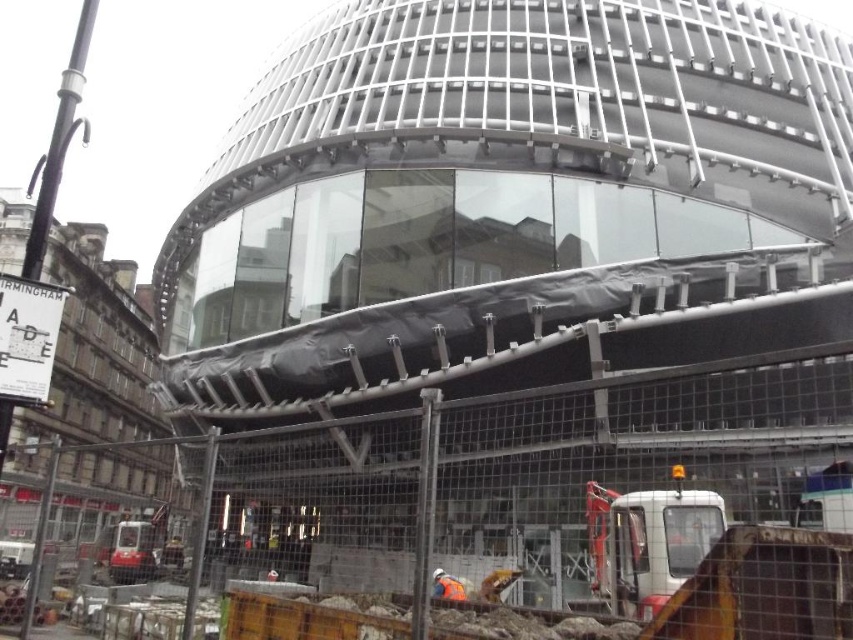
Does white plastic construction vehicle at lower right have a lesser height compared to orange hard hat at center?

No, white plastic construction vehicle at lower right is not shorter than orange hard hat at center.

Can you confirm if white plastic construction vehicle at lower right is wider than orange hard hat at center?

Yes, white plastic construction vehicle at lower right is wider than orange hard hat at center.

Between point (624, 516) and point (434, 593), which one is positioned in front?

Point (624, 516)

Locate an element on the screen. white plastic construction vehicle at lower right is located at coordinates (648, 541).

Does metal mesh fence at center have a larger size compared to orange hard hat at center?

Yes.

Identify the location of metal mesh fence at center. This screenshot has height=640, width=853. (546, 504).

This screenshot has height=640, width=853. What are the coordinates of `metal mesh fence at center` in the screenshot? It's located at (546, 504).

Find the location of a particular element. metal mesh fence at center is located at coordinates (546, 504).

Does metal mesh fence at center have a lesser height compared to metallic construction vehicle at lower left?

Incorrect, metal mesh fence at center's height does not fall short of metallic construction vehicle at lower left's.

Is point (238, 513) positioned before point (120, 532)?

Yes, it is in front of point (120, 532).

The height and width of the screenshot is (640, 853). I want to click on metal mesh fence at center, so click(x=546, y=504).

Locate an element on the screen. The image size is (853, 640). metal mesh fence at center is located at coordinates 546,504.